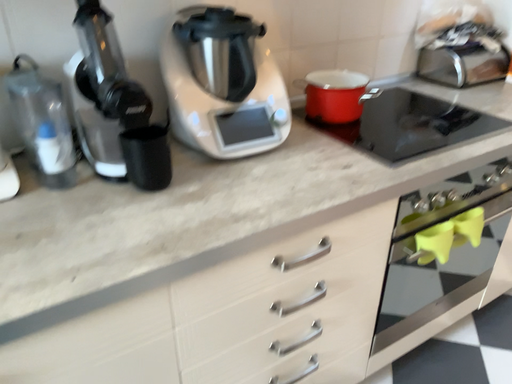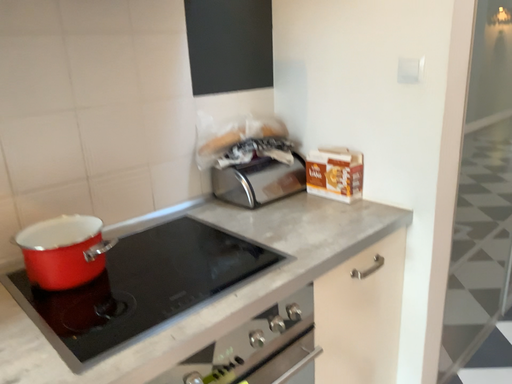
Question: Which way did the camera rotate in the video?

Choices:
 (A) rotated downward
 (B) rotated upward

Answer: (B)